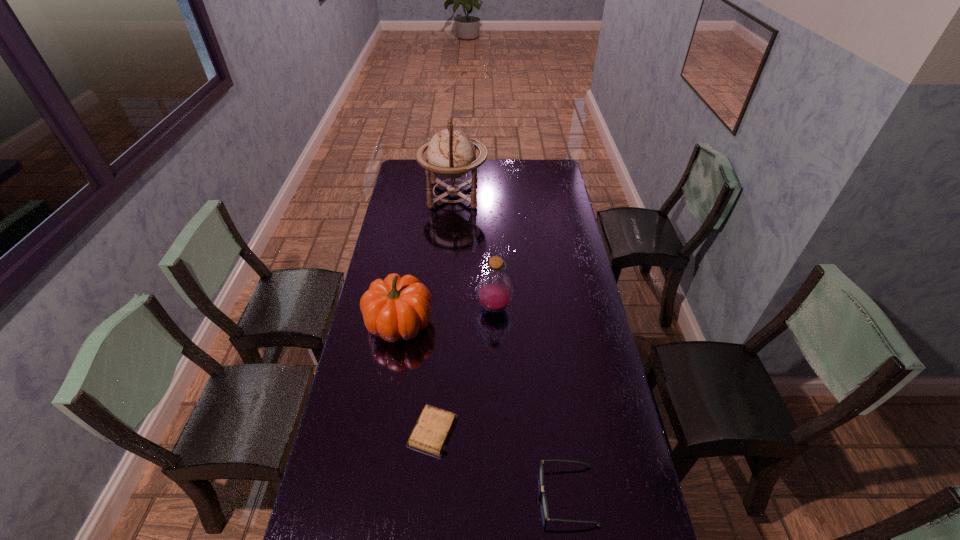
Locate an element on the screen. The image size is (960, 540). the tallest object is located at coordinates (451, 153).

Locate an element on the screen. The image size is (960, 540). the farthest object is located at coordinates (451, 153).

Identify the location of bottle. The image size is (960, 540). (495, 290).

Where is `pumpkin`? This screenshot has width=960, height=540. pumpkin is located at coordinates [x=395, y=307].

This screenshot has width=960, height=540. I want to click on the nearest object, so click(544, 501).

Locate an element on the screen. spectacles is located at coordinates (544, 501).

Image resolution: width=960 pixels, height=540 pixels. I want to click on the fourth farthest object, so click(x=434, y=426).

What are the coordinates of `the shortest object` in the screenshot? It's located at (434, 426).

What are the coordinates of `vacant point located at the front of the tallest object showing Africa` in the screenshot? It's located at (516, 195).

At what (x,y) coordinates should I click in order to perform the action: click on free space located 0.060m on the back of the bottle. Please return your answer as a coordinate pair (x, y). Looking at the image, I should click on (493, 284).